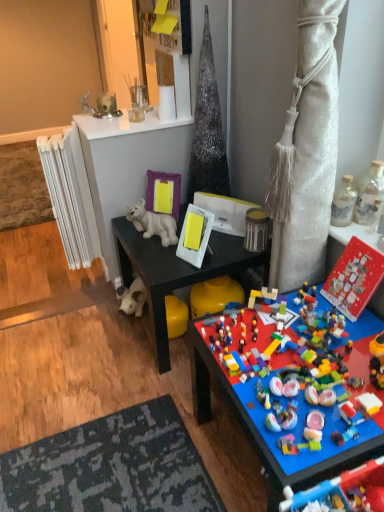
Question: From the image's perspective, would you say multicolored plastic lego pieces at lower right, which is counted as the seventh toy, starting from the top, is shown under white metallic radiator at left?

Choices:
 (A) no
 (B) yes

Answer: (B)

Question: Could you tell me if multicolored plastic lego pieces at lower right, the 2th toy when ordered from bottom to top, is turned towards white metallic radiator at left?

Choices:
 (A) yes
 (B) no

Answer: (B)

Question: Is multicolored plastic lego pieces at lower right, the 2th toy when ordered from bottom to top, placed right next to white metallic radiator at left?

Choices:
 (A) yes
 (B) no

Answer: (B)

Question: Is multicolored plastic lego pieces at lower right, which is counted as the seventh toy, starting from the top, behind white metallic radiator at left?

Choices:
 (A) no
 (B) yes

Answer: (A)

Question: Is white metallic radiator at left located within multicolored plastic lego pieces at lower right, which is counted as the seventh toy, starting from the top?

Choices:
 (A) no
 (B) yes

Answer: (A)

Question: Considering the relative sizes of multicolored plastic lego pieces at lower right, the 2th toy when ordered from bottom to top, and white metallic radiator at left in the image provided, is multicolored plastic lego pieces at lower right, the 2th toy when ordered from bottom to top, wider than white metallic radiator at left?

Choices:
 (A) yes
 (B) no

Answer: (A)

Question: From a real-world perspective, is metallic silver canister at upper right, the 4th toy ordered from the bottom, positioned under black matte desk at center based on gravity?

Choices:
 (A) no
 (B) yes

Answer: (A)

Question: Can you confirm if metallic silver canister at upper right, the 4th toy ordered from the bottom, is positioned to the right of black matte desk at center?

Choices:
 (A) no
 (B) yes

Answer: (B)

Question: From the image's perspective, is metallic silver canister at upper right, the 4th toy ordered from the bottom, on black matte desk at center?

Choices:
 (A) yes
 (B) no

Answer: (A)

Question: Is black matte desk at center surrounded by metallic silver canister at upper right, which is counted as the 5th toy, starting from the top?

Choices:
 (A) yes
 (B) no

Answer: (B)

Question: Is metallic silver canister at upper right, which is counted as the 5th toy, starting from the top, further to camera compared to black matte desk at center?

Choices:
 (A) yes
 (B) no

Answer: (A)

Question: Could metallic silver canister at upper right, the 4th toy ordered from the bottom, be considered to be inside multicolored plastic lego pieces at lower right, the 2th toy when ordered from bottom to top?

Choices:
 (A) yes
 (B) no

Answer: (B)